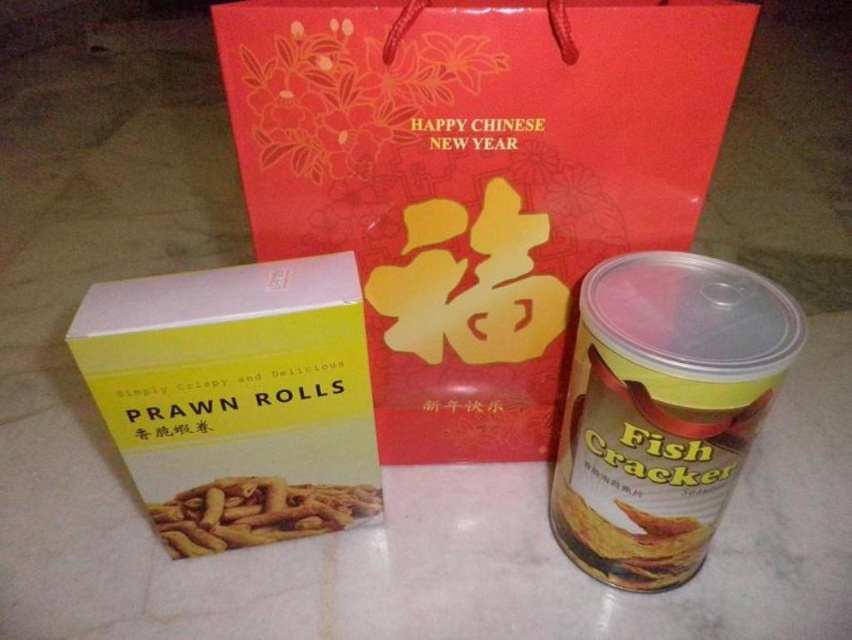
Question: Is matte plastic canister at right below yellow matte prawn rolls at center?

Choices:
 (A) no
 (B) yes

Answer: (A)

Question: Which point is closer to the camera?

Choices:
 (A) (281, 280)
 (B) (763, 282)
 (C) (304, 522)
 (D) (274, 26)

Answer: (D)

Question: Can you confirm if red paper bag at center is positioned below matte plastic canister at right?

Choices:
 (A) no
 (B) yes

Answer: (A)

Question: Considering the real-world distances, which object is closest to the red paper bag at center?

Choices:
 (A) yellow matte prawn rolls at center
 (B) yellow matte prawn rolls at left

Answer: (B)

Question: Where is matte plastic canister at right located in relation to yellow matte prawn rolls at center in the image?

Choices:
 (A) above
 (B) below

Answer: (A)

Question: Which point is closer to the camera?

Choices:
 (A) red paper bag at center
 (B) yellow matte prawn rolls at left

Answer: (A)